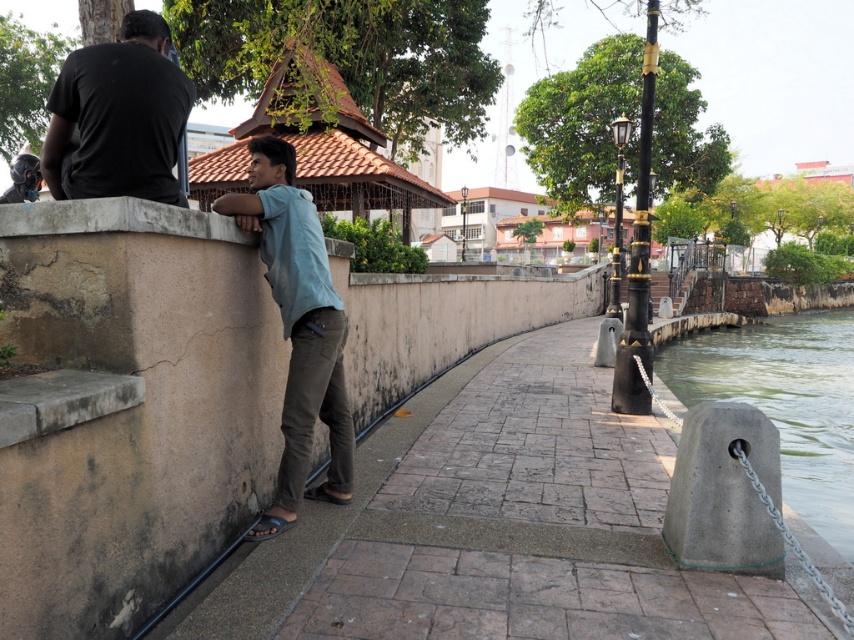
Looking at this image, can you confirm if gray concrete bollard at lower right is positioned to the right of light blue fabric shirt at center?

Correct, you'll find gray concrete bollard at lower right to the right of light blue fabric shirt at center.

Who is more forward, (781, 332) or (349, 435)?

Point (349, 435) is in front.

Measure the distance between gray concrete bollard at lower right and camera.

A distance of 6.03 meters exists between gray concrete bollard at lower right and camera.

The image size is (854, 640). Identify the location of gray concrete bollard at lower right. (785, 401).

What are the coordinates of `light blue fabric shirt at center` in the screenshot? It's located at (297, 326).

Between light blue fabric shirt at center and black matte shirt at upper left, which one is positioned lower?

light blue fabric shirt at center

What do you see at coordinates (297, 326) in the screenshot? I see `light blue fabric shirt at center` at bounding box center [297, 326].

Image resolution: width=854 pixels, height=640 pixels. Identify the location of light blue fabric shirt at center. (297, 326).

Describe the element at coordinates (785, 401) in the screenshot. This screenshot has height=640, width=854. I see `gray concrete bollard at lower right` at that location.

The width and height of the screenshot is (854, 640). What are the coordinates of `gray concrete bollard at lower right` in the screenshot? It's located at (785, 401).

Who is more distant from viewer, [809,317] or [153,51]?

The point [809,317] is behind.

Locate an element on the screen. Image resolution: width=854 pixels, height=640 pixels. gray concrete bollard at lower right is located at coordinates (785, 401).